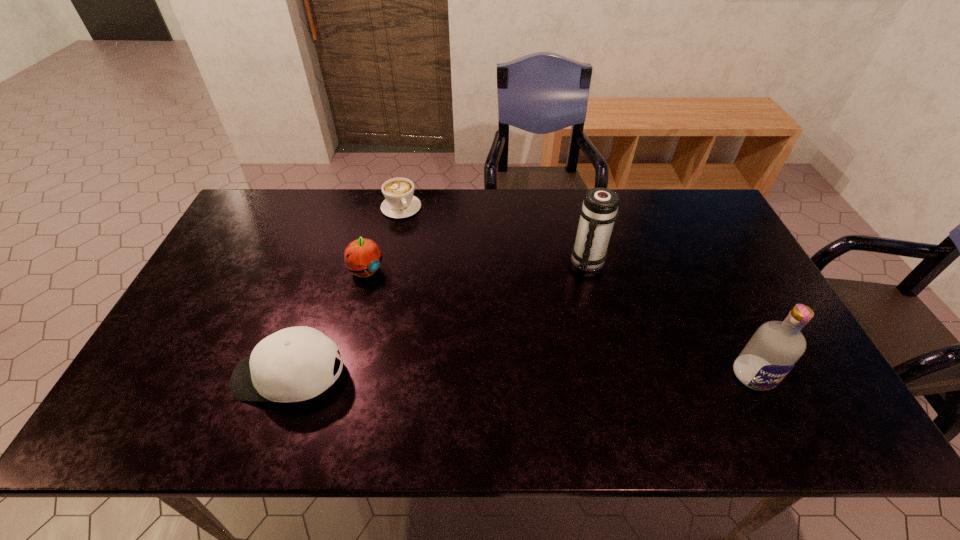
Select which object is the fourth closest to the baseball cap. Please provide its 2D coordinates. Your answer should be formatted as a tuple, i.e. [(x, y)], where the tuple contains the x and y coordinates of a point satisfying the conditions above.

[(776, 347)]

Find the location of a particular element. The height and width of the screenshot is (540, 960). free location that satisfies the following two spatial constraints: 1. on the back side of the apple; 2. on the right side of the farthest object is located at coordinates (382, 207).